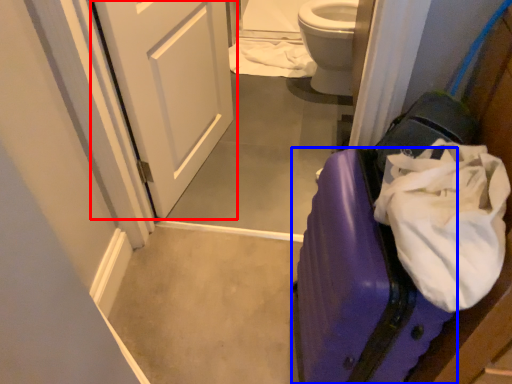
Question: Which of the following is the farthest to the observer, door (highlighted by a red box) or suitcase (highlighted by a blue box)?

Choices:
 (A) door
 (B) suitcase

Answer: (A)